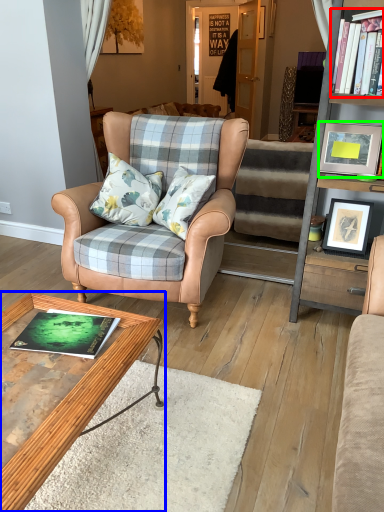
Question: Which is farther away from book (highlighted by a red box)? coffee table (highlighted by a blue box) or picture frame (highlighted by a green box)?

Choices:
 (A) coffee table
 (B) picture frame

Answer: (A)